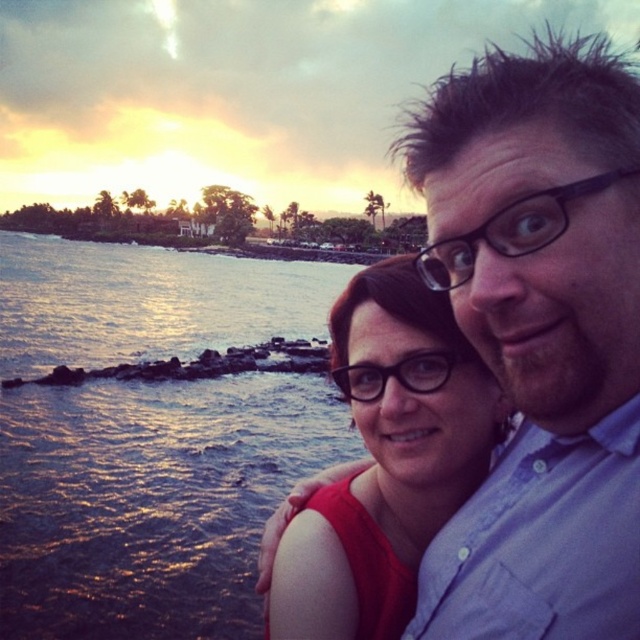
Question: Can you confirm if shiny blue water at lower left is positioned to the left of matte red dress at center?

Choices:
 (A) no
 (B) yes

Answer: (B)

Question: Which point is farther to the camera?

Choices:
 (A) matte black hair at upper center
 (B) shiny blue water at lower left

Answer: (B)

Question: Which point is farther to the camera?

Choices:
 (A) (563, 68)
 (B) (380, 461)
 (C) (237, 452)

Answer: (C)

Question: Among these points, which one is nearest to the camera?

Choices:
 (A) (346, 392)
 (B) (476, 80)

Answer: (B)

Question: Does matte black hair at upper center appear under shiny blue water at lower left?

Choices:
 (A) yes
 (B) no

Answer: (A)

Question: Is shiny blue water at lower left thinner than matte red dress at center?

Choices:
 (A) no
 (B) yes

Answer: (A)